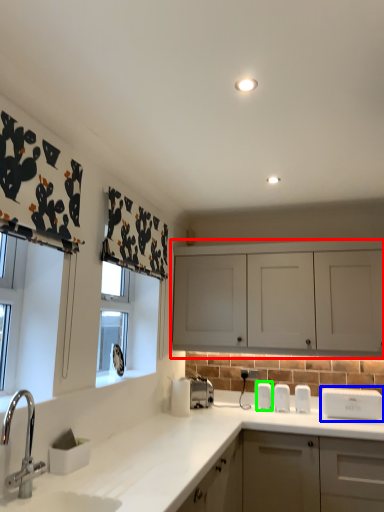
Question: Considering the real-world distances, which object is closest to cabinetry (highlighted by a red box)? appliance (highlighted by a blue box) or appliance (highlighted by a green box).

Choices:
 (A) appliance
 (B) appliance

Answer: (A)